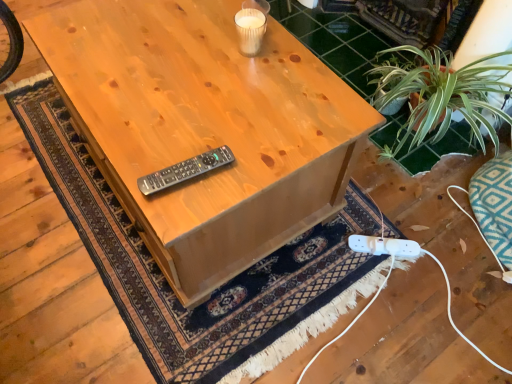
Question: Can you confirm if natural wood table at center is smaller than black plastic remote at center?

Choices:
 (A) yes
 (B) no

Answer: (B)

Question: Is natural wood table at center next to black plastic remote at center and touching it?

Choices:
 (A) no
 (B) yes

Answer: (A)

Question: Is natural wood table at center positioned far away from black plastic remote at center?

Choices:
 (A) no
 (B) yes

Answer: (A)

Question: From a real-world perspective, is natural wood table at center below black plastic remote at center?

Choices:
 (A) yes
 (B) no

Answer: (A)

Question: Can you confirm if natural wood table at center is bigger than black plastic remote at center?

Choices:
 (A) no
 (B) yes

Answer: (B)

Question: Is natural wood table at center positioned behind black plastic remote at center?

Choices:
 (A) yes
 (B) no

Answer: (B)

Question: Is black plastic remote at center outside of white plastic plug at lower right?

Choices:
 (A) yes
 (B) no

Answer: (A)

Question: Can you confirm if black plastic remote at center is shorter than white plastic plug at lower right?

Choices:
 (A) no
 (B) yes

Answer: (A)

Question: Is black plastic remote at center facing away from white plastic plug at lower right?

Choices:
 (A) no
 (B) yes

Answer: (A)

Question: Is the position of black plastic remote at center less distant than that of white plastic plug at lower right?

Choices:
 (A) no
 (B) yes

Answer: (B)

Question: Can you confirm if black plastic remote at center is bigger than white plastic plug at lower right?

Choices:
 (A) no
 (B) yes

Answer: (A)

Question: Is black plastic remote at center next to white plastic plug at lower right and touching it?

Choices:
 (A) no
 (B) yes

Answer: (A)

Question: From the image's perspective, is white plastic plug at lower right on natural wood table at center?

Choices:
 (A) no
 (B) yes

Answer: (A)